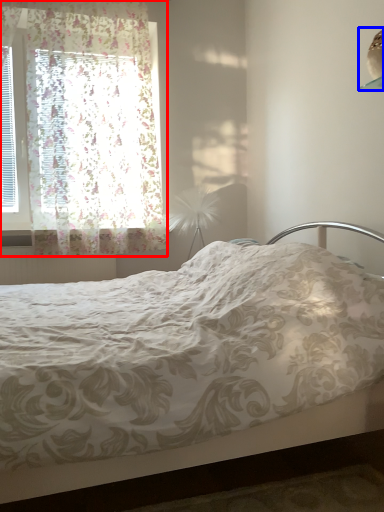
Question: Which of the following is the closest to the observer, window (highlighted by a red box) or lamp (highlighted by a blue box)?

Choices:
 (A) window
 (B) lamp

Answer: (B)